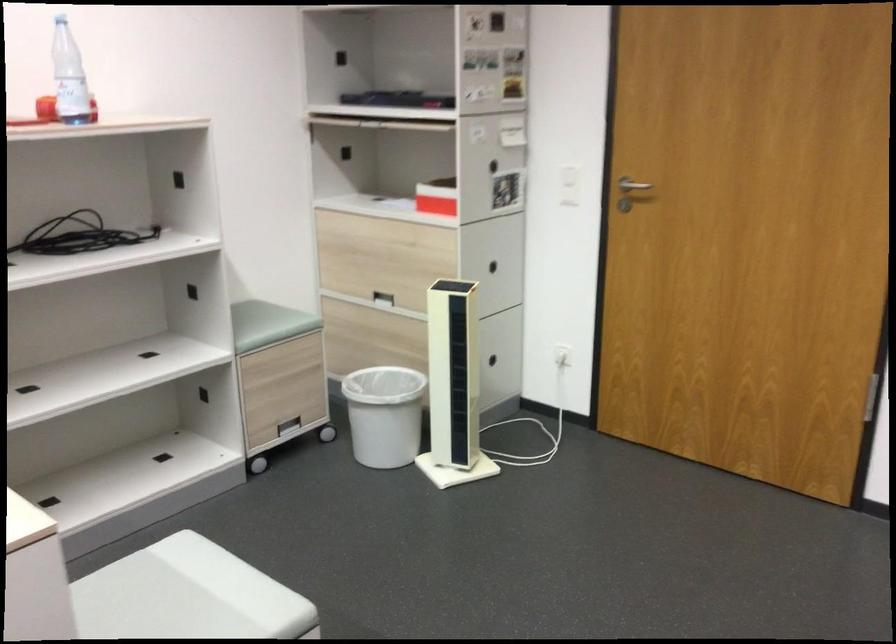
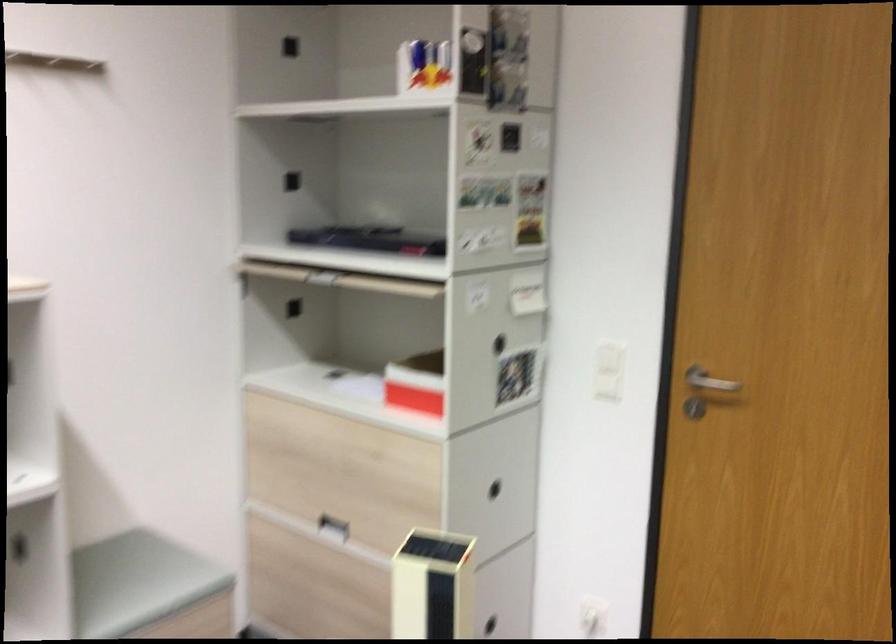
Question: The images are taken continuously from a first-person perspective. In which direction are you moving?

Choices:
 (A) Left
 (B) Right
 (C) Forward
 (D) Backward

Answer: (C)